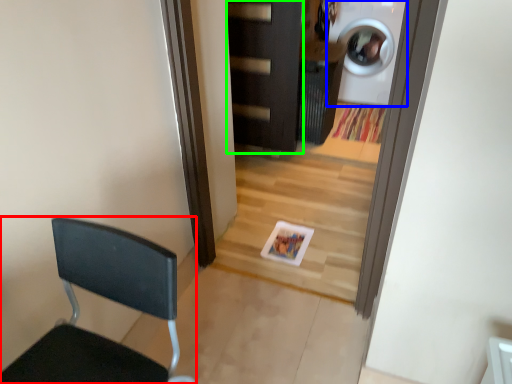
Question: Based on their relative distances, which object is nearer to chair (highlighted by a red box)? Choose from washing machine (highlighted by a blue box) and door (highlighted by a green box).

Choices:
 (A) washing machine
 (B) door

Answer: (B)